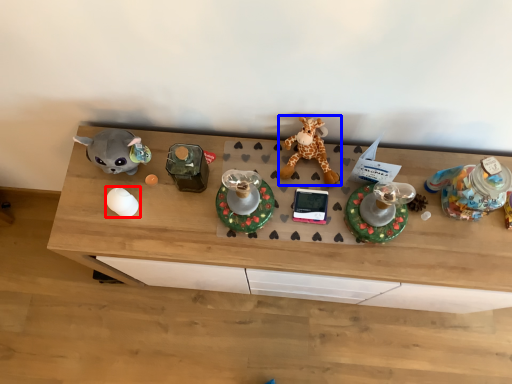
Question: Which point is closer to the camera, toy (highlighted by a red box) or giraffe (highlighted by a blue box)?

Choices:
 (A) toy
 (B) giraffe

Answer: (B)